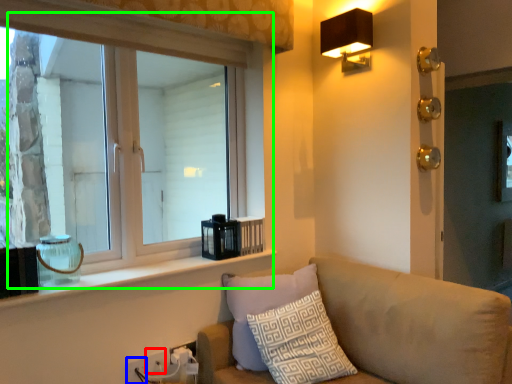
Question: Considering the real-world distances, which object is closest to electric outlet (highlighted by a red box)? electric outlet (highlighted by a blue box) or window (highlighted by a green box).

Choices:
 (A) electric outlet
 (B) window

Answer: (A)